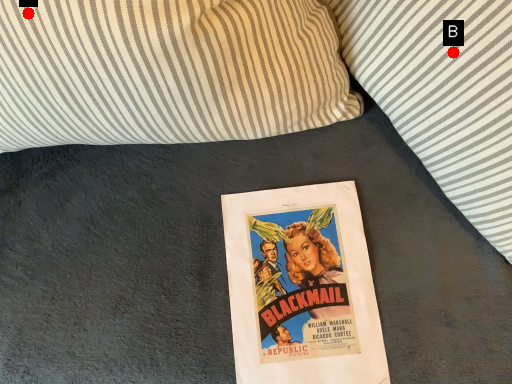
Question: Two points are circled on the image, labeled by A and B beside each circle. Which point appears farthest from the camera in this image?

Choices:
 (A) A is further
 (B) B is further

Answer: (B)